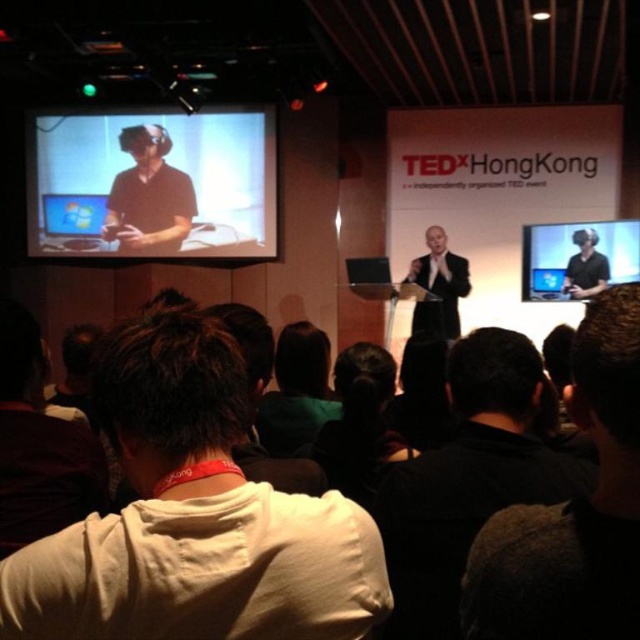
Question: Does dark brown hair at center appear under matte black vr headset at upper right?

Choices:
 (A) yes
 (B) no

Answer: (A)

Question: Is matte black vr headset at upper center to the left of matte black vr headset at upper left from the viewer's perspective?

Choices:
 (A) yes
 (B) no

Answer: (B)

Question: Which of these objects is positioned farthest from the white hoodie at center?

Choices:
 (A) dark brown hair at center
 (B) matte black vr headset at upper center

Answer: (B)

Question: Is dark brown hair at center to the right of white hoodie at center from the viewer's perspective?

Choices:
 (A) no
 (B) yes

Answer: (B)

Question: Which point appears closest to the camera in this image?

Choices:
 (A) (604, 272)
 (B) (285, 436)
 (C) (157, 140)

Answer: (B)

Question: Which object is closer to the camera taking this photo?

Choices:
 (A) matte black laptop at upper center
 (B) matte black laptop at upper left
 (C) matte black vr headset at upper right
 (D) white cotton hoodie at center

Answer: (D)